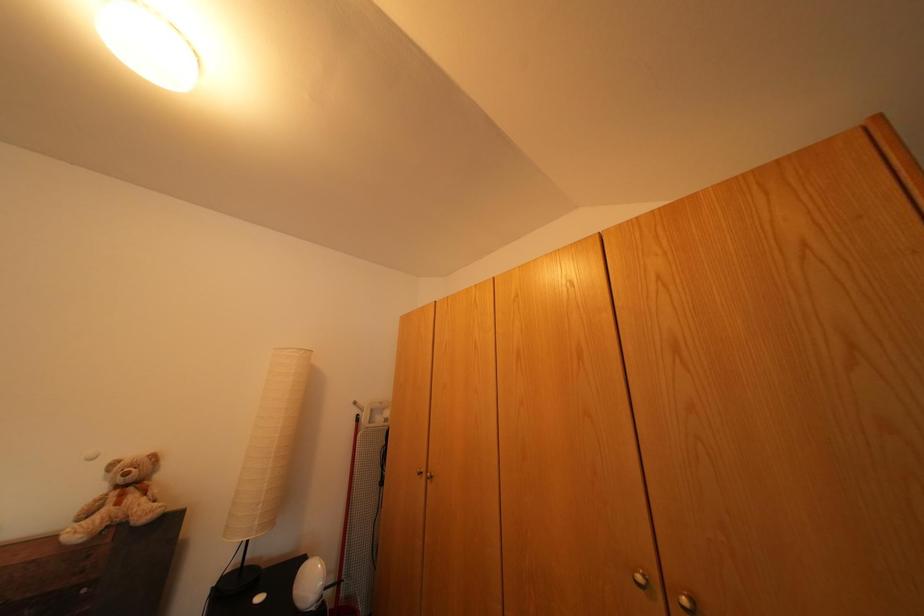
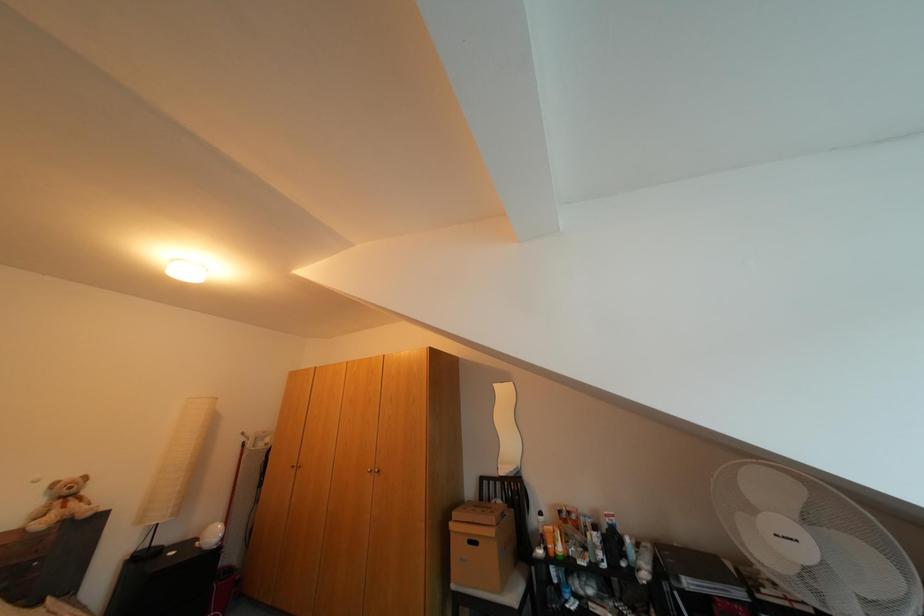
Question: In a continuous first-person perspective shot, in which direction is the camera moving?

Choices:
 (A) Left
 (B) Right
 (C) Forward
 (D) Backward

Answer: (D)